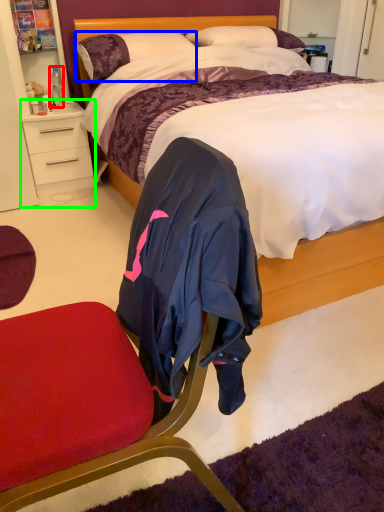
Question: Which is nearer to the bottle (highlighted by a red box)? pillow (highlighted by a blue box) or desk (highlighted by a green box).

Choices:
 (A) pillow
 (B) desk

Answer: (B)